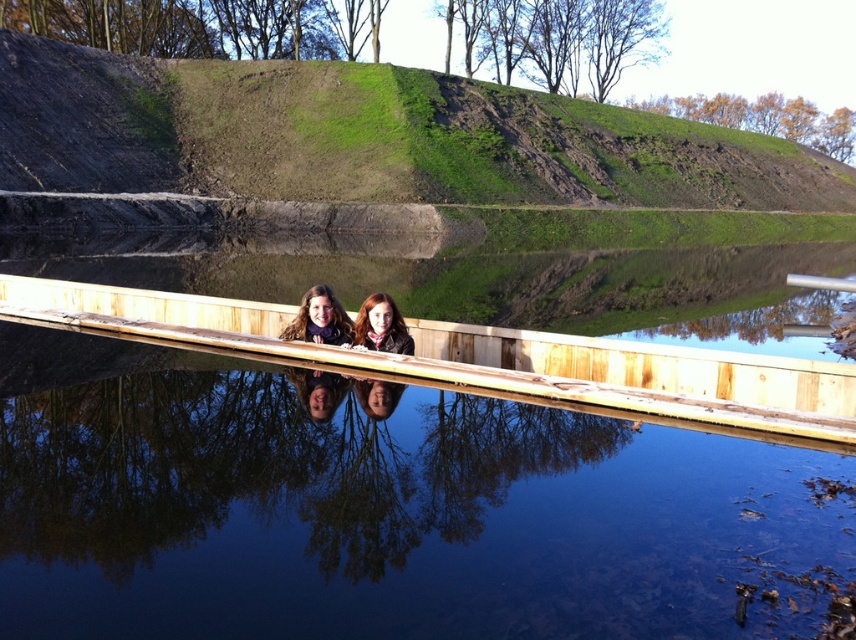
Question: From the image, what is the correct spatial relationship of matte purple sweater at center in relation to matte brown scarf at center?

Choices:
 (A) right
 (B) left

Answer: (B)

Question: Does wooden ledge at center appear on the left side of matte brown scarf at center?

Choices:
 (A) yes
 (B) no

Answer: (A)

Question: Which of these objects is positioned farthest from the matte brown scarf at center?

Choices:
 (A) matte purple sweater at center
 (B) wooden ledge at center

Answer: (B)

Question: Which object is farther from the camera taking this photo?

Choices:
 (A) wooden ledge at center
 (B) matte purple sweater at center
 (C) matte brown scarf at center

Answer: (B)

Question: Does wooden ledge at center have a lesser width compared to matte purple sweater at center?

Choices:
 (A) yes
 (B) no

Answer: (B)

Question: Which object is closer to the camera taking this photo?

Choices:
 (A) wooden ledge at center
 (B) matte purple sweater at center

Answer: (A)